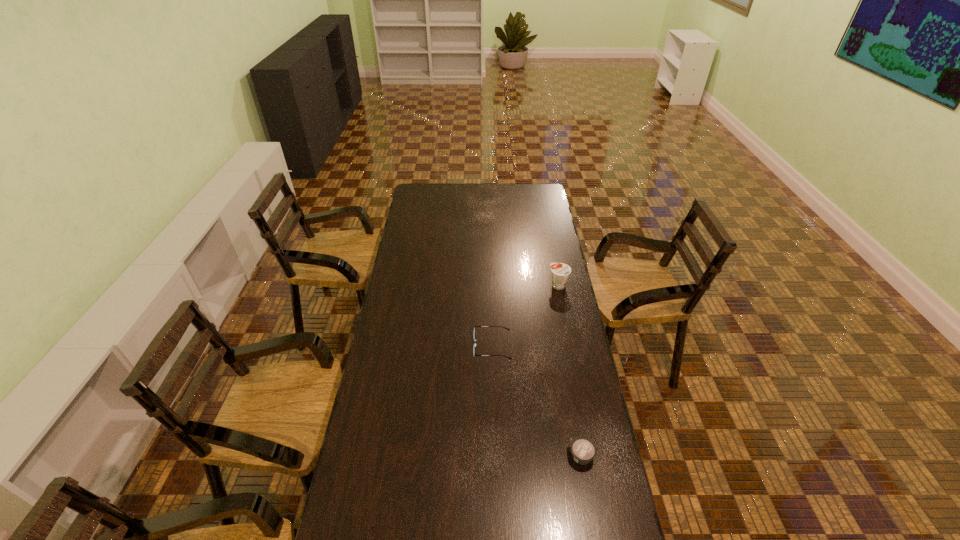
The height and width of the screenshot is (540, 960). In order to click on free spot between the shorter yogurt and the spectacles in this screenshot , I will do `click(537, 401)`.

The image size is (960, 540). Find the location of `empty space that is in between the farther yogurt and the nearer yogurt`. empty space that is in between the farther yogurt and the nearer yogurt is located at coordinates (570, 371).

You are a GUI agent. You are given a task and a screenshot of the screen. Output one action in this format:
    pyautogui.click(x=<x>, y=<y>)
    Task: Click on the vacant area that lies between the spectacles and the farthest object
    The height and width of the screenshot is (540, 960).
    Given the screenshot: What is the action you would take?
    pyautogui.click(x=525, y=316)

Where is `free space between the nearest object and the second farthest object`? The height and width of the screenshot is (540, 960). free space between the nearest object and the second farthest object is located at coordinates point(537,401).

In order to click on empty location between the farther yogurt and the leftmost object in this screenshot , I will do `click(525, 316)`.

I want to click on object that ranks as the second closest to the second nearest object, so click(x=583, y=450).

Point out which object is positioned as the second nearest to the leftmost object. Please provide its 2D coordinates. Your answer should be formatted as a tuple, i.e. [(x, y)], where the tuple contains the x and y coordinates of a point satisfying the conditions above.

[(583, 450)]

Where is `free space that satisfies the following two spatial constraints: 1. on the lenses of the nearest object; 2. on the right side of the second farthest object`? The image size is (960, 540). free space that satisfies the following two spatial constraints: 1. on the lenses of the nearest object; 2. on the right side of the second farthest object is located at coordinates (495, 456).

This screenshot has width=960, height=540. In order to click on vacant point that satisfies the following two spatial constraints: 1. on the lenses of the leftmost object; 2. on the left side of the nearest object in this screenshot , I will do `click(495, 456)`.

Locate an element on the screen. vacant space that satisfies the following two spatial constraints: 1. on the lenses of the nearer yogurt; 2. on the left side of the leftmost object is located at coordinates (495, 456).